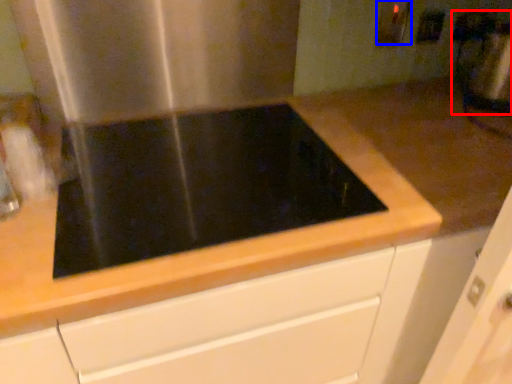
Question: Among these objects, which one is farthest to the camera, blender (highlighted by a red box) or electric outlet (highlighted by a blue box)?

Choices:
 (A) blender
 (B) electric outlet

Answer: (B)